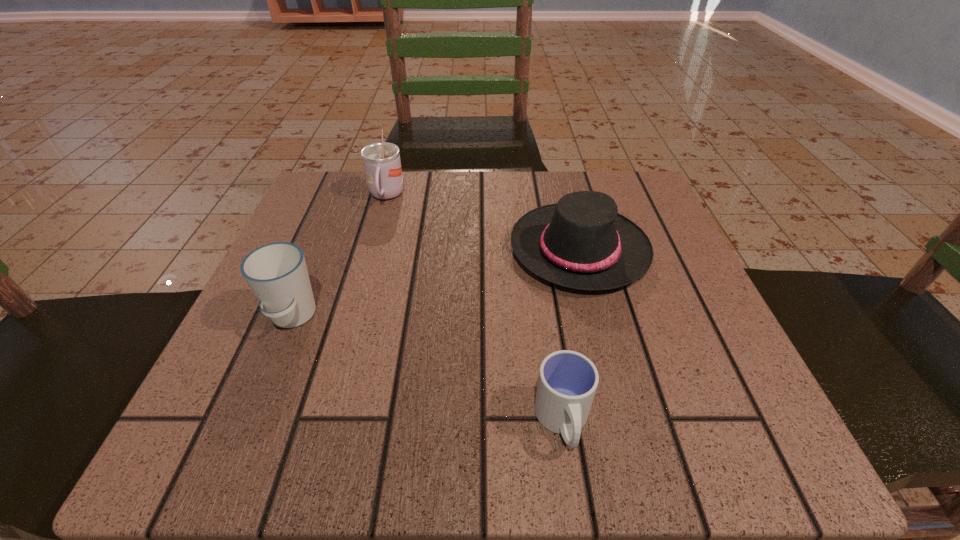
Identify the location of free spot between the second farthest cup and the second cup from left to right. The height and width of the screenshot is (540, 960). (339, 256).

Where is `vacant area between the dress hat and the nearest cup`? This screenshot has width=960, height=540. vacant area between the dress hat and the nearest cup is located at coordinates (571, 335).

Where is `unoccupied position between the second nearest cup and the dress hat`? unoccupied position between the second nearest cup and the dress hat is located at coordinates (436, 284).

Choose which object is the second nearest neighbor to the leftmost cup. Please provide its 2D coordinates. Your answer should be formatted as a tuple, i.e. [(x, y)], where the tuple contains the x and y coordinates of a point satisfying the conditions above.

[(581, 242)]

I want to click on object that stands as the third closest to the dress hat, so click(x=277, y=274).

The height and width of the screenshot is (540, 960). Identify the location of cup that can be found as the closest to the leftmost object. (382, 165).

Locate an element on the screen. The height and width of the screenshot is (540, 960). cup that can be found as the closest to the dress hat is located at coordinates (567, 382).